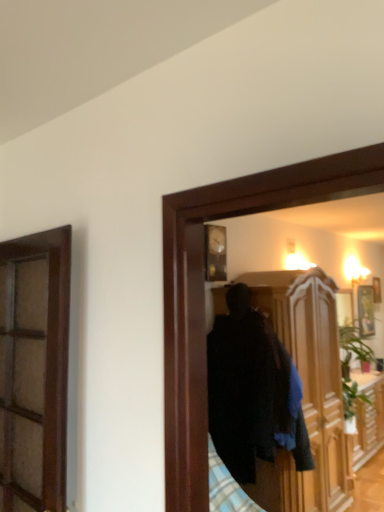
Question: From the image's perspective, relative to wooden cabinet at center, is gold metallic picture frame at upper right above or below?

Choices:
 (A) below
 (B) above

Answer: (B)

Question: Considering the positions of gold metallic picture frame at upper right and wooden cabinet at center in the image, is gold metallic picture frame at upper right wider or thinner than wooden cabinet at center?

Choices:
 (A) thin
 (B) wide

Answer: (A)

Question: From a real-world perspective, is gold metallic picture frame at upper right positioned above or below wooden cabinet at center?

Choices:
 (A) below
 (B) above

Answer: (B)

Question: Considering the positions of point (269, 502) and point (370, 325), is point (269, 502) closer or farther from the camera than point (370, 325)?

Choices:
 (A) closer
 (B) farther

Answer: (A)

Question: In terms of height, does wooden cabinet at center look taller or shorter compared to gold metallic picture frame at upper right?

Choices:
 (A) tall
 (B) short

Answer: (A)

Question: Looking at the image, does wooden cabinet at center seem bigger or smaller compared to gold metallic picture frame at upper right?

Choices:
 (A) big
 (B) small

Answer: (A)

Question: Is wooden cabinet at center inside the boundaries of gold metallic picture frame at upper right, or outside?

Choices:
 (A) outside
 (B) inside

Answer: (A)